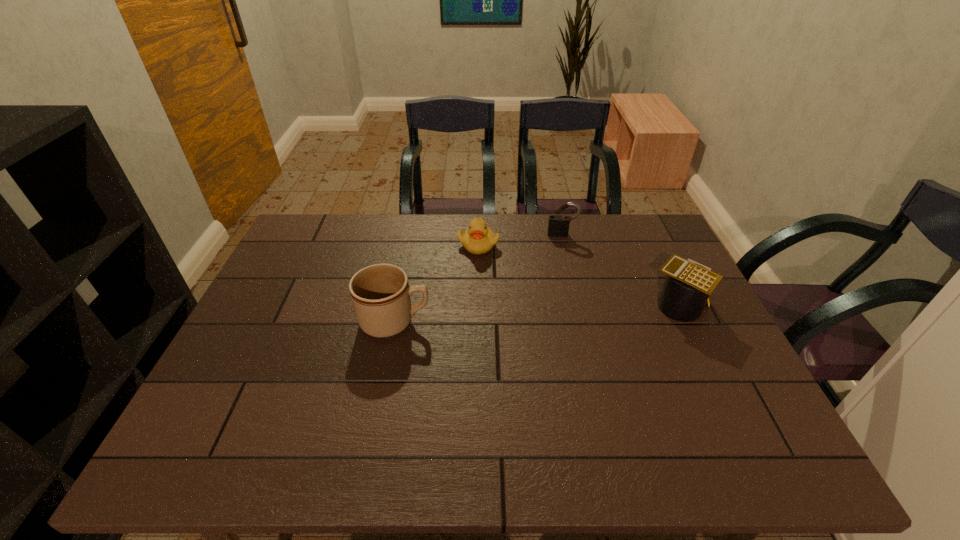
Find the location of a particular element. The width and height of the screenshot is (960, 540). free space on the desktop that is between the leftmost object and the calculator and is positioned on the beak of the shortest object is located at coordinates (522, 314).

The height and width of the screenshot is (540, 960). In order to click on free space on the desktop that is between the mug and the calculator and is positioned with the keyhole on the front of the second object from right to left in this screenshot , I will do `click(565, 312)`.